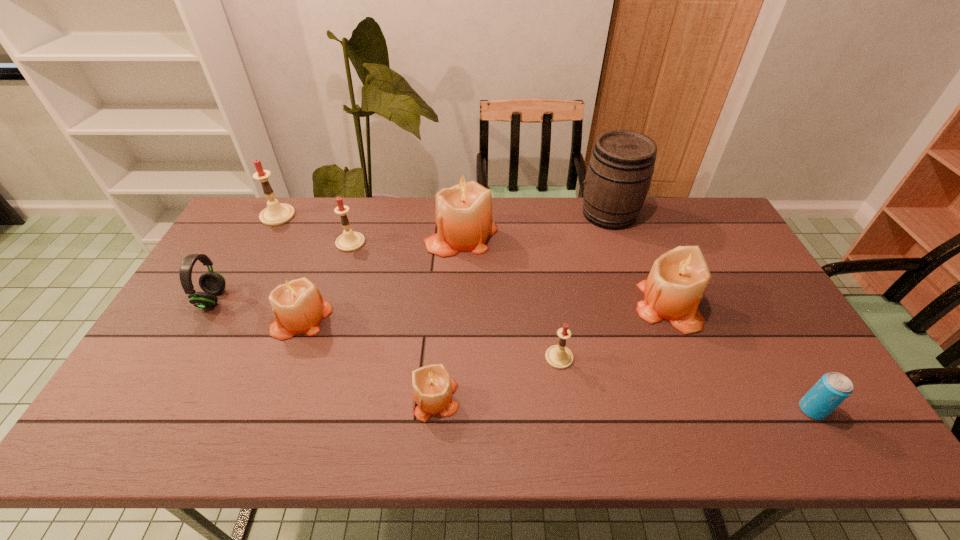
Select which candle is the second closest to the rightmost beige candle. Please provide its 2D coordinates. Your answer should be formatted as a tuple, i.e. [(x, y)], where the tuple contains the x and y coordinates of a point satisfying the conditions above.

[(464, 220)]

At what (x,y) coordinates should I click in order to perform the action: click on the second closest candle to the rightmost object. Please return your answer as a coordinate pair (x, y). Looking at the image, I should click on (558, 356).

Locate which beige candle is the second closest to the biggest red candle. Please provide its 2D coordinates. Your answer should be formatted as a tuple, i.e. [(x, y)], where the tuple contains the x and y coordinates of a point satisfying the conditions above.

[(464, 220)]

Identify which beige candle is the fourth nearest to the soda can. Please provide its 2D coordinates. Your answer should be formatted as a tuple, i.e. [(x, y)], where the tuple contains the x and y coordinates of a point satisfying the conditions above.

[(297, 304)]

Identify which red candle is the nearest to the leftmost beige candle. Please provide its 2D coordinates. Your answer should be formatted as a tuple, i.e. [(x, y)], where the tuple contains the x and y coordinates of a point satisfying the conditions above.

[(349, 241)]

Identify which red candle is the nearest to the leftmost red candle. Please provide its 2D coordinates. Your answer should be formatted as a tuple, i.e. [(x, y)], where the tuple contains the x and y coordinates of a point satisfying the conditions above.

[(349, 241)]

You are a GUI agent. You are given a task and a screenshot of the screen. Output one action in this format:
    pyautogui.click(x=<x>, y=<y>)
    Task: Click on the free space that satisfies the following two spatial constraints: 1. on the back side of the rightmost candle; 2. on the left side of the nearest beige candle
    The height and width of the screenshot is (540, 960).
    Given the screenshot: What is the action you would take?
    pyautogui.click(x=444, y=306)

Where is `free location that satisfies the following two spatial constraints: 1. on the front side of the smallest red candle; 2. on the left side of the second smallest beige candle`? The height and width of the screenshot is (540, 960). free location that satisfies the following two spatial constraints: 1. on the front side of the smallest red candle; 2. on the left side of the second smallest beige candle is located at coordinates (287, 357).

Identify the location of free location that satisfies the following two spatial constraints: 1. on the ear cups of the sixth farthest candle; 2. on the left side of the black headset. This screenshot has width=960, height=540. (179, 357).

Find the location of a particular element. This screenshot has width=960, height=540. vacant space that satisfies the following two spatial constraints: 1. on the back side of the farthest beige candle; 2. on the left side of the second smallest beige candle is located at coordinates (332, 235).